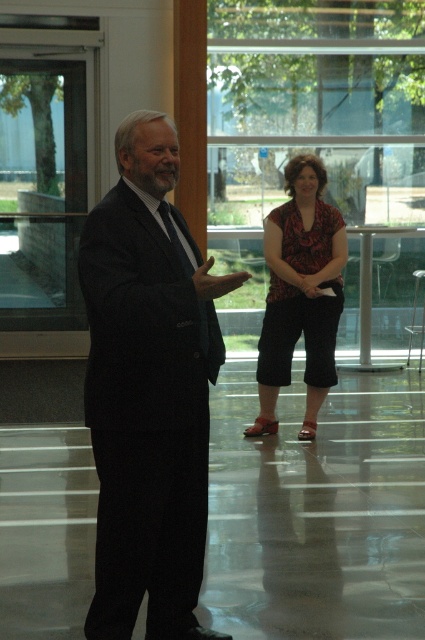
Question: Is the position of floral fabric blouse at center more distant than that of black silk tie at center?

Choices:
 (A) yes
 (B) no

Answer: (A)

Question: Observing the image, what is the correct spatial positioning of floral fabric blouse at center in reference to black silk tie at center?

Choices:
 (A) left
 (B) right

Answer: (B)

Question: Which of the following is the closest to the observer?

Choices:
 (A) (206, 353)
 (B) (136, 608)
 (C) (297, 308)

Answer: (B)

Question: Is matte black suit at center bigger than floral fabric blouse at center?

Choices:
 (A) no
 (B) yes

Answer: (A)

Question: Which is farther from the floral fabric blouse at center?

Choices:
 (A) black silk tie at center
 (B) matte black suit at center

Answer: (B)

Question: Which point is closer to the camera taking this photo?

Choices:
 (A) (317, 275)
 (B) (204, 340)

Answer: (B)